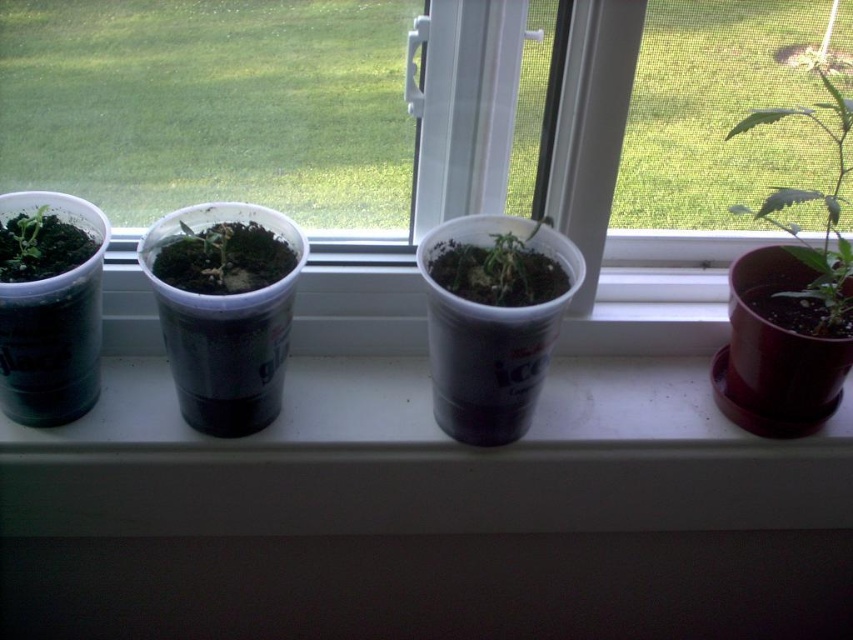
You are a gardener who wants to water the plants. You have a watering can that can only hold 1 liter of water. The transparent plastic cups at center can hold 500ml of water, and the green matte plastic cup at center can hold 300ml. If you water each plant equally, how many times do you need to refill the watering can to water all the plants once?

The transparent plastic cups at center can hold 500ml and the green matte plastic cup at center can hold 300ml. Each plant needs to be watered with the same amount. The total water required is 500ml x 1 transparent cup plant and 300ml x 1 green cup plant, totaling 800ml. Since the watering can holds 1 liter, you only need to refill it once to water all plants.

You are standing in front of the windowsill with the four potted plants. You notice two specific points on the windowsill labeled as point 1 at coordinates point (822, 193) and point 2 at coordinates point (206, 257). If you want to place a new small plant pot between these two points so that it is closer to the front of the windowsill, where should you place it?

You should place the new small plant pot closer to point 1 at coordinates point (822, 193) because it is further to the camera than point 2 at coordinates point (206, 257), meaning point 1 is nearer to the front of the windowsill.